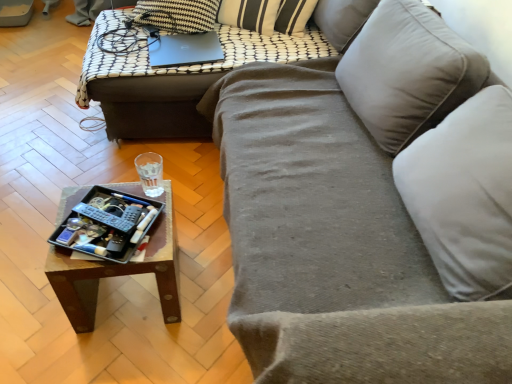
Question: Considering the positions of black plastic remote at lower left and matte black laptop at upper center in the image, is black plastic remote at lower left wider or thinner than matte black laptop at upper center?

Choices:
 (A) wide
 (B) thin

Answer: (B)

Question: From the image's perspective, is black plastic remote at lower left positioned above or below matte black laptop at upper center?

Choices:
 (A) below
 (B) above

Answer: (A)

Question: Which object is positioned closest to the wooden tray at center?

Choices:
 (A) matte black laptop at upper center
 (B) wooden tray at center
 (C) metallic tray at lower left
 (D) black plastic remote at lower left
 (E) velvet gray couch at center

Answer: (A)

Question: Estimate the real-world distances between objects in this image. Which object is closer to the velvet gray couch at center?

Choices:
 (A) matte black laptop at upper center
 (B) wooden tray at center
 (C) black plastic remote at lower left
 (D) wooden tray at center
 (E) metallic tray at lower left

Answer: (D)